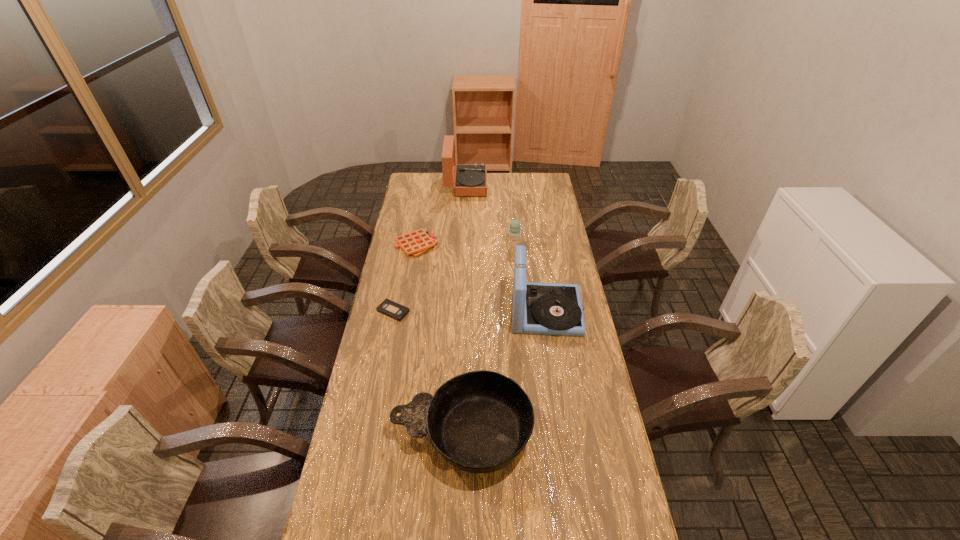
Where is `empty space between the third tallest object and the nearest object`? empty space between the third tallest object and the nearest object is located at coordinates (488, 339).

What are the coordinates of `unoccupied position between the farther phonograph record and the fifth tallest object` in the screenshot? It's located at (442, 215).

The width and height of the screenshot is (960, 540). Identify the location of vacant space that's between the nearer phonograph record and the waffle. (482, 278).

Image resolution: width=960 pixels, height=540 pixels. What are the coordinates of `vacant area that lies between the left phonograph record and the waffle` in the screenshot? It's located at (442, 215).

Where is `free point between the fourth shortest object and the farther phonograph record`? The width and height of the screenshot is (960, 540). free point between the fourth shortest object and the farther phonograph record is located at coordinates (490, 215).

Where is `object that is the second nearest to the ice cream`? Image resolution: width=960 pixels, height=540 pixels. object that is the second nearest to the ice cream is located at coordinates (415, 243).

At what (x,y) coordinates should I click in order to perform the action: click on the second closest object to the left phonograph record. Please return your answer as a coordinate pair (x, y). Looking at the image, I should click on (514, 232).

Identify the location of vacant space that satisfies the following two spatial constraints: 1. on the back side of the videotape; 2. on the left side of the third tallest object. Image resolution: width=960 pixels, height=540 pixels. (406, 245).

This screenshot has height=540, width=960. I want to click on free spot that satisfies the following two spatial constraints: 1. on the face of the farthest object; 2. on the front side of the shortest object, so click(461, 311).

The height and width of the screenshot is (540, 960). In order to click on free point that satisfies the following two spatial constraints: 1. with the handle extending from the side of the nearest object; 2. on the left side of the right phonograph record in this screenshot , I will do `click(466, 312)`.